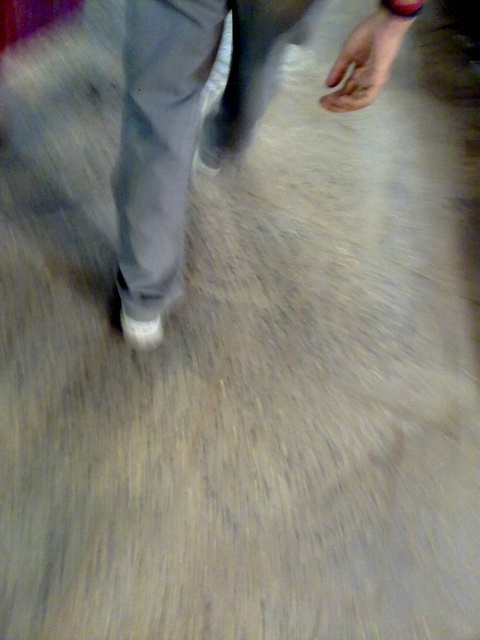
You are a photographer trying to adjust the focus of your camera to capture the white fabric pants at center. The camera has a focus point at point [183,124]. Will adjusting the focus to this point ensure the white fabric pants at center is in focus?

→ The white fabric pants at center is located at point [183,124], so adjusting the focus to this point will ensure the white fabric pants at center is in focus.

You are a photographer trying to capture a clear shot of the white fabric pants at center and the white matte shoe at lower center. Since the image is slightly blurred, can you determine which object is closer to the camera based on the focus? Please explain.

The white fabric pants at center is closer to the viewer than the white matte shoe at lower center, so the pants would be in focus while the shoe might be slightly blurred if the depth of field is shallow.